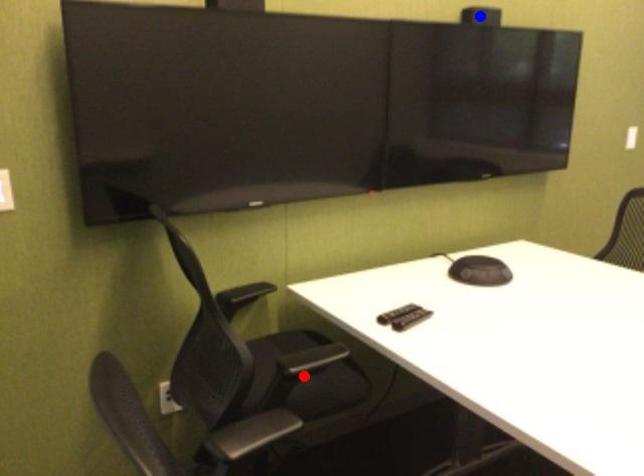
Question: In the image, two points are highlighted. Which point is nearer to the camera? Reply with the corresponding letter.

Choices:
 (A) blue point
 (B) red point

Answer: (B)